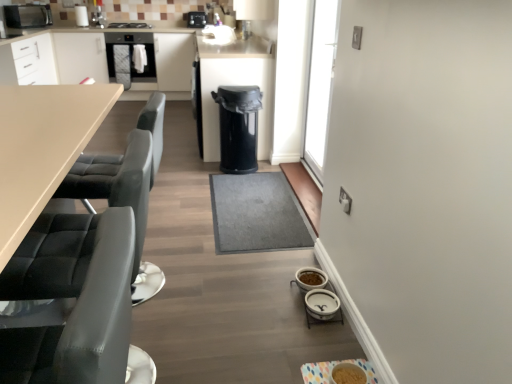
Question: Is black matte stove at upper center in front of transparent glass door at upper right?

Choices:
 (A) yes
 (B) no

Answer: (B)

Question: From a real-world perspective, is black matte stove at upper center physically below transparent glass door at upper right?

Choices:
 (A) yes
 (B) no

Answer: (B)

Question: From a real-world perspective, does black matte stove at upper center stand above transparent glass door at upper right?

Choices:
 (A) no
 (B) yes

Answer: (B)

Question: Does black matte stove at upper center appear on the right side of transparent glass door at upper right?

Choices:
 (A) yes
 (B) no

Answer: (B)

Question: Is black matte stove at upper center positioned with its back to transparent glass door at upper right?

Choices:
 (A) no
 (B) yes

Answer: (A)

Question: Does black matte stove at upper center have a lesser width compared to transparent glass door at upper right?

Choices:
 (A) yes
 (B) no

Answer: (B)

Question: Can you confirm if white ceramic bowls at lower right, the 5th appliance when ordered from left to right, is positioned to the right of matte black oven at upper left?

Choices:
 (A) no
 (B) yes

Answer: (B)

Question: Is white ceramic bowls at lower right, acting as the 3th appliance starting from the right, positioned with its back to matte black oven at upper left?

Choices:
 (A) yes
 (B) no

Answer: (B)

Question: Can you confirm if white ceramic bowls at lower right, positioned as the 6th appliance in back-to-front order, is positioned to the left of matte black oven at upper left?

Choices:
 (A) no
 (B) yes

Answer: (A)

Question: Is white ceramic bowls at lower right, the 5th appliance when ordered from left to right, further to the viewer compared to matte black oven at upper left?

Choices:
 (A) yes
 (B) no

Answer: (B)

Question: Does white ceramic bowls at lower right, the 6th appliance in the top-to-bottom sequence, have a smaller size compared to matte black oven at upper left?

Choices:
 (A) yes
 (B) no

Answer: (A)

Question: Can you confirm if white ceramic bowls at lower right, which appears as the 2th appliance when viewed from the front, is bigger than matte black oven at upper left?

Choices:
 (A) yes
 (B) no

Answer: (B)

Question: Is white ceramic bowls at lower right, positioned as the 6th appliance in back-to-front order, turned away from black plastic camera at upper center, the 1th appliance in the back-to-front sequence?

Choices:
 (A) yes
 (B) no

Answer: (B)